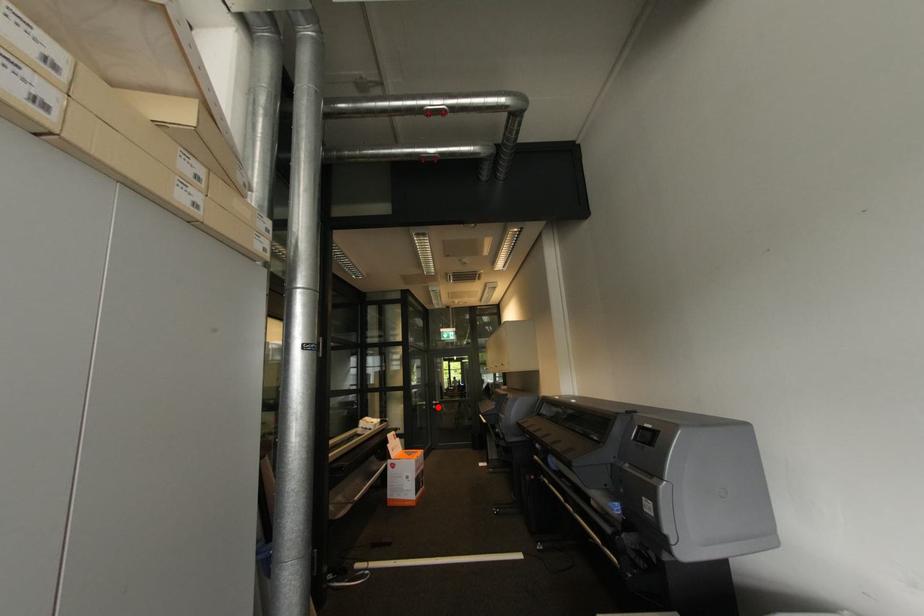
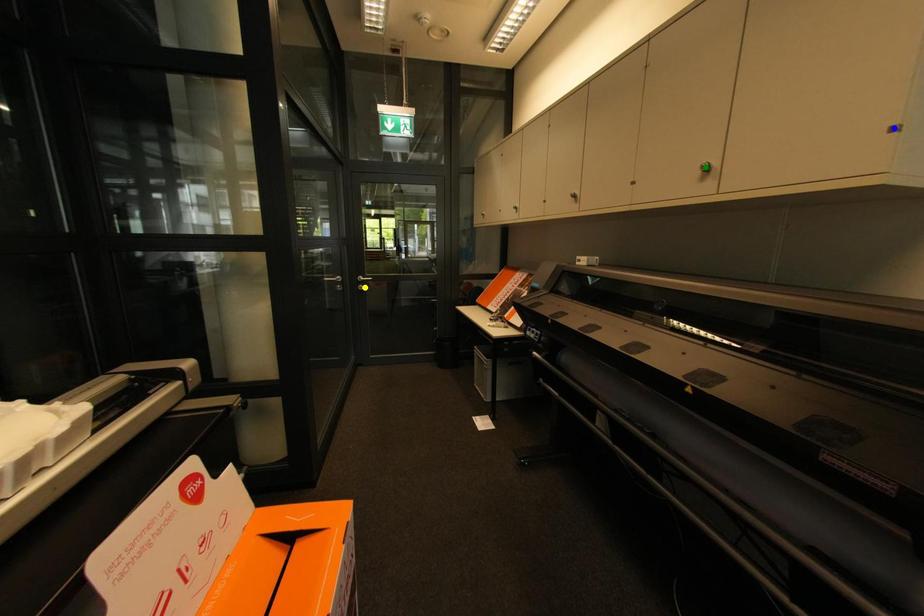
Question: I am providing you with two images of the same scene from different viewpoints. A red point is marked on the first image. You are given multiple points on the second image. Which point in image 2 represents the same 3d spot as the red point in image 1?

Choices:
 (A) green point
 (B) yellow point
 (C) blue point

Answer: (B)